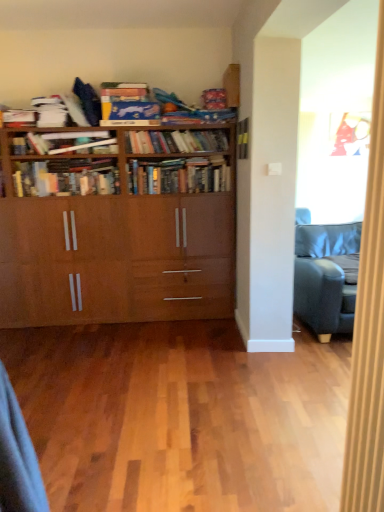
Describe the element at coordinates (178, 176) in the screenshot. Image resolution: width=384 pixels, height=512 pixels. I see `hardcover books at center, arranged as the 5th book when viewed from the top` at that location.

In order to face blue cardboard book at upper center, which ranks as the 6th book in bottom-to-top order, should I rotate leftwards or rightwards?

Turn left by 8.153 degrees to look at blue cardboard book at upper center, which ranks as the 6th book in bottom-to-top order.

Find the location of a particular element. The width and height of the screenshot is (384, 512). wooden bookshelf at center, which is the fifth book from bottom to top is located at coordinates (176, 141).

What do you see at coordinates (66, 177) in the screenshot? I see `hardcover books at center, the first book positioned from the bottom` at bounding box center [66, 177].

Measure the distance between point (123,350) and camera.

Result: The distance of point (123,350) from camera is 3.44 meters.

Locate an element on the screen. This screenshot has width=384, height=512. light brown wood floor at center is located at coordinates (181, 417).

The height and width of the screenshot is (512, 384). Describe the element at coordinates (242, 138) in the screenshot. I see `matte black book at center, which is the third book in bottom-to-top order` at that location.

You are a GUI agent. You are given a task and a screenshot of the screen. Output one action in this format:
    pyautogui.click(x=<x>, y=<y>)
    Task: Click on the wooden bookcase at center
    This screenshot has width=384, height=512.
    Given the screenshot: What is the action you would take?
    pyautogui.click(x=117, y=233)

Based on the photo, what's the angular difference between matte white book at upper left, the third book viewed from the top, and blue cardboard book at upper center, which ranks as the 6th book in bottom-to-top order,'s facing directions?

1.23 degrees separate the facing orientations of matte white book at upper left, the third book viewed from the top, and blue cardboard book at upper center, which ranks as the 6th book in bottom-to-top order.

Is matte white book at upper left, the fourth book from the bottom, positioned with its back to blue cardboard book at upper center, which ranks as the 6th book in bottom-to-top order?

No, matte white book at upper left, the fourth book from the bottom,'s orientation is not away from blue cardboard book at upper center, which ranks as the 6th book in bottom-to-top order.

Identify the location of the 1st book located beneath the blue cardboard book at upper center, acting as the first book starting from the top (from a real-world perspective). (61, 142).

From the image's perspective, who appears lower, matte white book at upper left, the third book viewed from the top, or blue cardboard book at upper center, which ranks as the 6th book in bottom-to-top order?

From the image's view, matte white book at upper left, the third book viewed from the top, is below.

Considering the relative positions of matte black book at center, which is the third book in bottom-to-top order, and light brown wood floor at center in the image provided, is matte black book at center, which is the third book in bottom-to-top order, to the left of light brown wood floor at center from the viewer's perspective?

In fact, matte black book at center, which is the third book in bottom-to-top order, is to the right of light brown wood floor at center.

Is matte black book at center, which is the third book in bottom-to-top order, shorter than light brown wood floor at center?

No, matte black book at center, which is the third book in bottom-to-top order, is not shorter than light brown wood floor at center.

Is matte black book at center, acting as the fourth book starting from the top, bigger than light brown wood floor at center?

No.

Which of these two, blue cardboard book at upper center, acting as the first book starting from the top, or wooden bookshelf at center, marked as the second book in a top-to-bottom arrangement, is thinner?

wooden bookshelf at center, marked as the second book in a top-to-bottom arrangement.

Are blue cardboard book at upper center, acting as the first book starting from the top, and wooden bookshelf at center, which is the fifth book from bottom to top, far apart?

No, there isn't a large distance between blue cardboard book at upper center, acting as the first book starting from the top, and wooden bookshelf at center, which is the fifth book from bottom to top.

From the image's perspective, relative to wooden bookshelf at center, marked as the second book in a top-to-bottom arrangement, is blue cardboard book at upper center, which ranks as the 6th book in bottom-to-top order, above or below?

Based on their image positions, blue cardboard book at upper center, which ranks as the 6th book in bottom-to-top order, is located above wooden bookshelf at center, marked as the second book in a top-to-bottom arrangement.

Is wooden bookshelf at center, which is the fifth book from bottom to top, at the back of light brown wood floor at center?

No, light brown wood floor at center is not facing the opposite direction of wooden bookshelf at center, which is the fifth book from bottom to top.

Consider the image. From the image's perspective, which object appears higher, light brown wood floor at center or wooden bookshelf at center, which is the fifth book from bottom to top?

wooden bookshelf at center, which is the fifth book from bottom to top.

Who is bigger, light brown wood floor at center or wooden bookshelf at center, which is the fifth book from bottom to top?

light brown wood floor at center is bigger.

Is blue cardboard book at upper center, which ranks as the 6th book in bottom-to-top order, facing away from matte white book at upper left, the third book viewed from the top?

blue cardboard book at upper center, which ranks as the 6th book in bottom-to-top order, does not have its back to matte white book at upper left, the third book viewed from the top.

In the scene shown: Is blue cardboard book at upper center, which ranks as the 6th book in bottom-to-top order, far away from matte white book at upper left, the fourth book from the bottom?

blue cardboard book at upper center, which ranks as the 6th book in bottom-to-top order, is near matte white book at upper left, the fourth book from the bottom, not far away.

Considering the sizes of objects blue cardboard book at upper center, which ranks as the 6th book in bottom-to-top order, and matte white book at upper left, the fourth book from the bottom, in the image provided, who is smaller, blue cardboard book at upper center, which ranks as the 6th book in bottom-to-top order, or matte white book at upper left, the fourth book from the bottom,?

With smaller size is matte white book at upper left, the fourth book from the bottom.

From the picture: Does blue cardboard book at upper center, which ranks as the 6th book in bottom-to-top order, have a greater width compared to hardcover books at center, arranged as the 5th book when viewed from the top?

Indeed, blue cardboard book at upper center, which ranks as the 6th book in bottom-to-top order, has a greater width compared to hardcover books at center, arranged as the 5th book when viewed from the top.

Can you tell me how much blue cardboard book at upper center, which ranks as the 6th book in bottom-to-top order, and hardcover books at center, the 2th book positioned from the bottom, differ in facing direction?

2.27 degrees.

Is blue cardboard book at upper center, which ranks as the 6th book in bottom-to-top order, positioned behind hardcover books at center, the 2th book positioned from the bottom?

→ No, blue cardboard book at upper center, which ranks as the 6th book in bottom-to-top order, is closer to the camera.

Would you consider blue cardboard book at upper center, acting as the first book starting from the top, to be distant from hardcover books at center, arranged as the 5th book when viewed from the top?

Actually, blue cardboard book at upper center, acting as the first book starting from the top, and hardcover books at center, arranged as the 5th book when viewed from the top, are a little close together.

Between light brown wood floor at center and wooden bookcase at center, which one appears on the right side from the viewer's perspective?

light brown wood floor at center is more to the right.

Which is less distant, (x=238, y=340) or (x=19, y=289)?

The point (x=238, y=340) is in front.

Does light brown wood floor at center lie in front of wooden bookcase at center?

That is True.

How different are the orientations of light brown wood floor at center and wooden bookcase at center in degrees?

light brown wood floor at center and wooden bookcase at center are facing 89.4 degrees away from each other.

What are the coordinates of `the 1st book in front of the matte white book at upper left, the fourth book from the bottom, counting from the anchor's position` in the screenshot? It's located at (127, 102).

What are the coordinates of `book that is the 3rd object located above the light brown wood floor at center (from the image's perspective)` in the screenshot? It's located at (242, 138).

Estimate the real-world distances between objects in this image. Which object is closer to hardcover books at center, acting as the 6th book starting from the top, matte black book at center, acting as the fourth book starting from the top, or blue cardboard book at upper center, acting as the first book starting from the top?

blue cardboard book at upper center, acting as the first book starting from the top, lies closer to hardcover books at center, acting as the 6th book starting from the top, than the other object.

Looking at the image, which one is located closer to matte white book at upper left, the third book viewed from the top, hardcover books at center, the first book positioned from the bottom, or matte black book at center, which is the third book in bottom-to-top order?

hardcover books at center, the first book positioned from the bottom, is closer to matte white book at upper left, the third book viewed from the top.

From the image, which object appears to be farther from matte black book at center, acting as the fourth book starting from the top, light brown wood floor at center or wooden bookshelf at center, which is the fifth book from bottom to top?

light brown wood floor at center.

From the image, which object appears to be farther from matte black book at center, which is the third book in bottom-to-top order, light brown wood floor at center or hardcover books at center, acting as the 6th book starting from the top?

Based on the image, light brown wood floor at center appears to be further to matte black book at center, which is the third book in bottom-to-top order.

Based on their spatial positions, is matte black book at center, acting as the fourth book starting from the top, or matte white book at upper left, the third book viewed from the top, further from blue cardboard book at upper center, acting as the first book starting from the top?

The object further to blue cardboard book at upper center, acting as the first book starting from the top, is matte black book at center, acting as the fourth book starting from the top.

Based on the photo, considering their positions, is matte white book at upper left, the fourth book from the bottom, positioned closer to wooden bookcase at center than light brown wood floor at center?

Among the two, matte white book at upper left, the fourth book from the bottom, is located nearer to wooden bookcase at center.

Estimate the real-world distances between objects in this image. Which object is further from wooden bookcase at center, blue cardboard book at upper center, acting as the first book starting from the top, or wooden bookshelf at center, marked as the second book in a top-to-bottom arrangement?

blue cardboard book at upper center, acting as the first book starting from the top, is positioned further to the anchor wooden bookcase at center.

Looking at this image, when comparing their distances from matte white book at upper left, the third book viewed from the top, does wooden bookshelf at center, marked as the second book in a top-to-bottom arrangement, or matte black book at center, acting as the fourth book starting from the top, seem closer?

Among the two, wooden bookshelf at center, marked as the second book in a top-to-bottom arrangement, is located nearer to matte white book at upper left, the third book viewed from the top.

Locate an element on the screen. Image resolution: width=384 pixels, height=512 pixels. bookcase located between light brown wood floor at center and wooden bookshelf at center, which is the fifth book from bottom to top, in the depth direction is located at coordinates (117, 233).

Locate an element on the screen. bookcase positioned between light brown wood floor at center and hardcover books at center, the 2th book positioned from the bottom, from near to far is located at coordinates (117, 233).

At what (x,y) coordinates should I click in order to perform the action: click on bookcase between hardcover books at center, the first book positioned from the bottom, and matte black book at center, which is the third book in bottom-to-top order. Please return your answer as a coordinate pair (x, y). The height and width of the screenshot is (512, 384). Looking at the image, I should click on (117, 233).

Find the location of a particular element. This screenshot has width=384, height=512. bookcase between blue cardboard book at upper center, acting as the first book starting from the top, and light brown wood floor at center in the up-down direction is located at coordinates (117, 233).